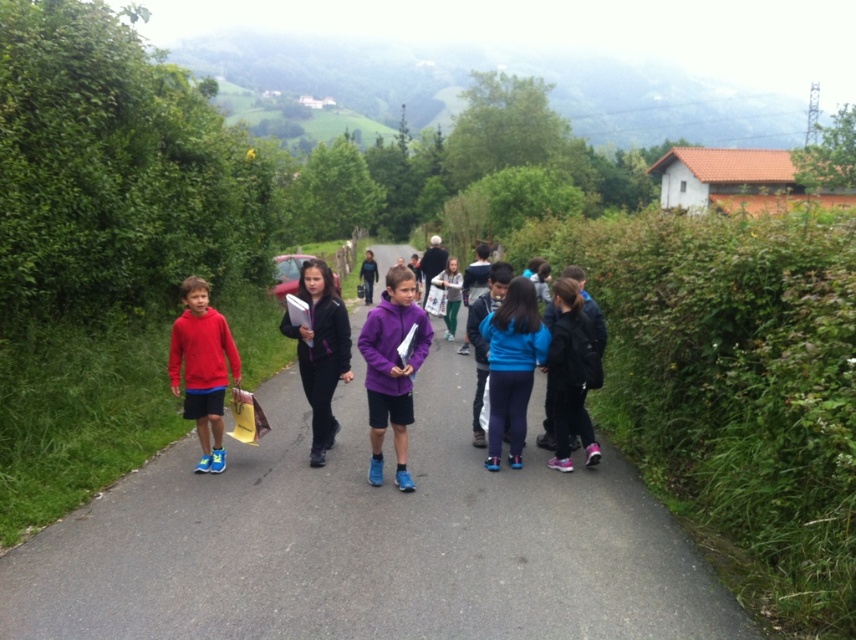
Does blue fleece jacket at center appear over black matte jacket at center?

Incorrect, blue fleece jacket at center is not positioned above black matte jacket at center.

Does blue fleece jacket at center have a lesser height compared to black matte jacket at center?

Correct, blue fleece jacket at center is not as tall as black matte jacket at center.

Locate an element on the screen. blue fleece jacket at center is located at coordinates (512, 365).

This screenshot has height=640, width=856. I want to click on blue fleece jacket at center, so click(512, 365).

Between point (383, 429) and point (513, 348), which one is positioned behind?

Point (513, 348)

Consider the image. Is purple fleece jacket at center above blue fleece jacket at center?

No, purple fleece jacket at center is not above blue fleece jacket at center.

Does point (381, 324) come behind point (498, 413)?

No, it is in front of (498, 413).

Locate an element on the screen. The width and height of the screenshot is (856, 640). purple fleece jacket at center is located at coordinates (391, 369).

Is smooth asphalt road at center shorter than black matte jacket at center?

Correct, smooth asphalt road at center is not as tall as black matte jacket at center.

Who is taller, smooth asphalt road at center or black matte jacket at center?

black matte jacket at center

Who is more forward, [642,628] or [314,285]?

Point [642,628] is more forward.

The width and height of the screenshot is (856, 640). What are the coordinates of `smooth asphalt road at center` in the screenshot? It's located at (367, 541).